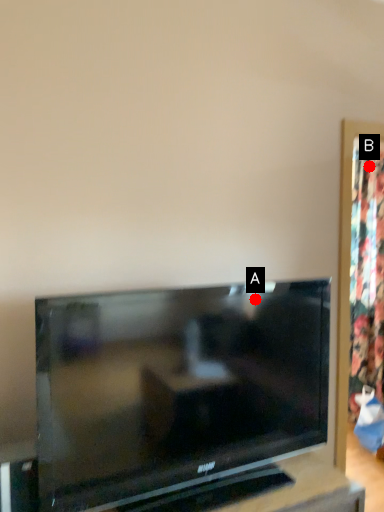
Question: Two points are circled on the image, labeled by A and B beside each circle. Among these points, which one is nearest to the camera?

Choices:
 (A) A is closer
 (B) B is closer

Answer: (A)